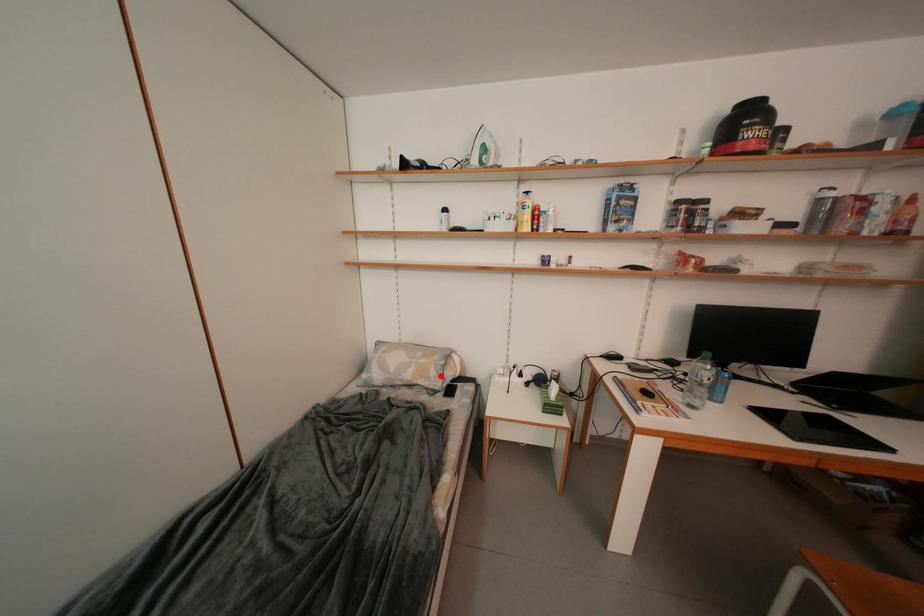
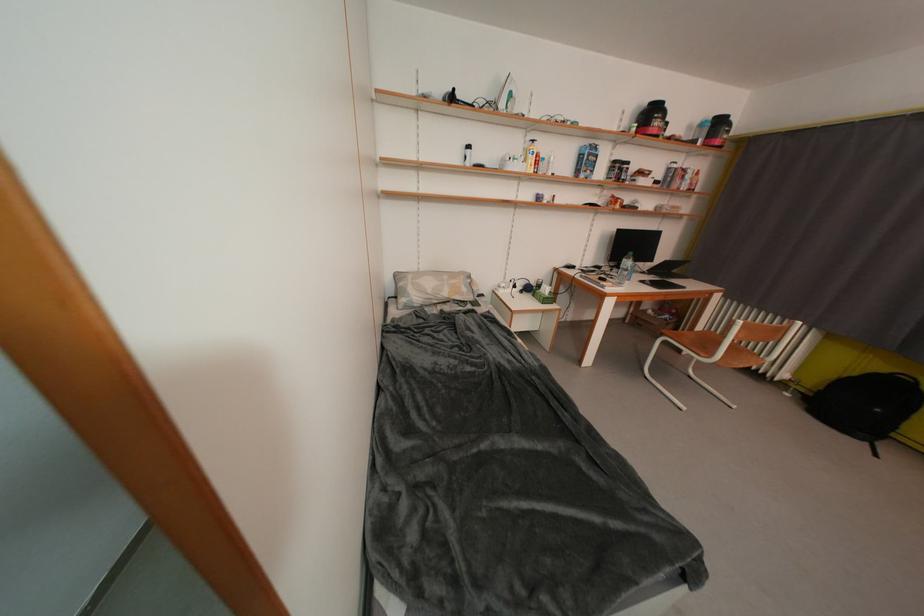
Question: A red point is marked in image1. In image2, is the corresponding 3D point closer to the camera or farther? Reply with the corresponding letter.

Choices:
 (A) The corresponding 3D point is closer.
 (B) The corresponding 3D point is farther.

Answer: (A)